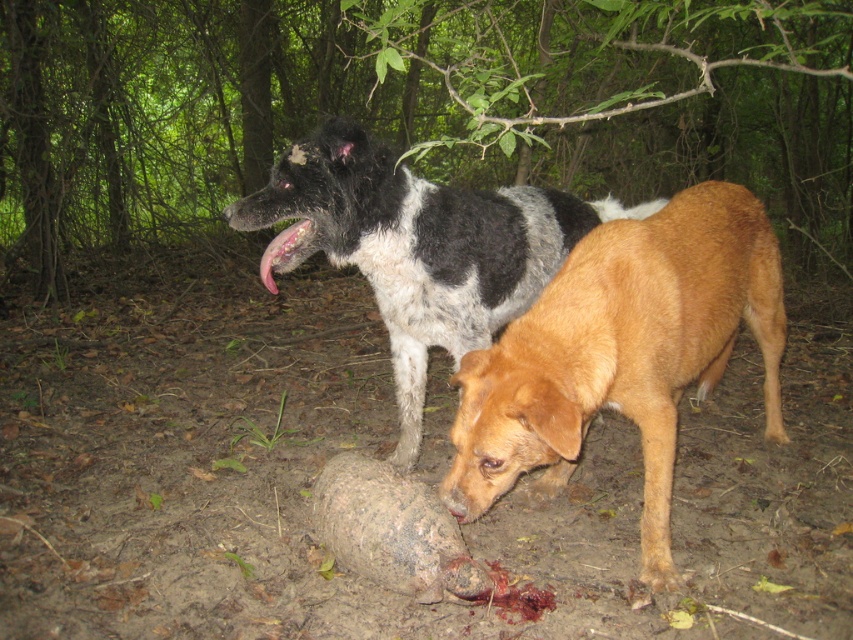
You are standing in a wooded area and see the brown furry dog at lower center. Based on the coordinates provided, where exactly is the brown furry dog positioned in relation to the lower edge of the scene?

The brown furry dog at lower center is located at point 0.553 on the horizontal axis and 0.730 on the vertical axis, meaning it is positioned slightly to the right of the center and closer to the lower edge of the scene.

You are a veterinarian assessing the space between two dogs in a wooded area. The dogs are the brown furry dog at lower center and the black and white fur dog at center. Based on their widths, which dog occupies less horizontal space in the image?

The brown furry dog at lower center has a smaller width compared to the black and white fur dog at center, so it occupies less horizontal space in the image.

You are standing at the point marked by coordinates point (622, 353). Looking around, you see a brown furry dog at lower center. Which direction should you face to see the brown furry dog at lower center?

The point marked by coordinates point (622, 353) is the location of the brown furry dog at lower center, so you are already facing it.